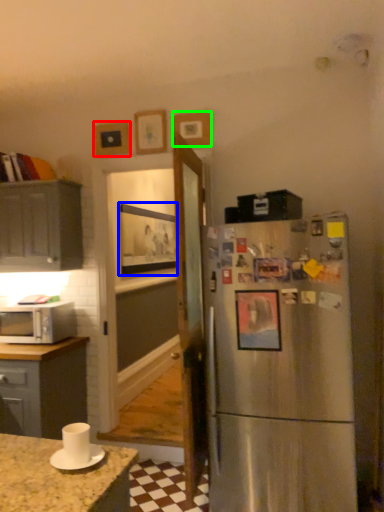
Question: Which object is positioned farthest from picture frame (highlighted by a red box)? Select from picture frame (highlighted by a blue box) and picture frame (highlighted by a green box).

Choices:
 (A) picture frame
 (B) picture frame

Answer: (A)